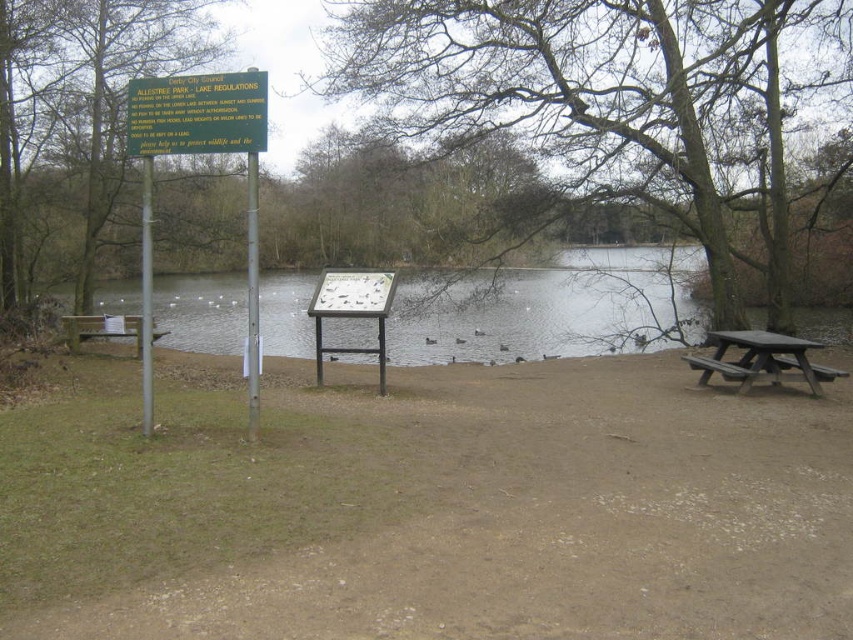
You are a visitor at Allestree Park and want to sit down near the lake. You see the green plastic sign at upper center and the brown wooden bench at left. Which object is closer to the lake edge?

The brown wooden bench at left is closer to the lake edge because the green plastic sign at upper center is to the right of it, meaning the bench is positioned nearer to the water.

You are planning to take a photo of both the green plastic sign at upper center and the dark brown wooden picnic table at lower right. Which object should you focus on first if you want to capture both in one frame without moving the camera?

The green plastic sign at upper center is much taller than the dark brown wooden picnic table at lower right. To capture both in one frame, focus on the taller object first, which is the green plastic sign at upper center, then adjust the camera angle to include the smaller dark brown wooden picnic table at lower right.